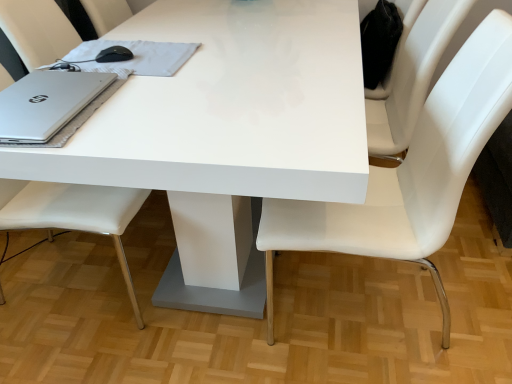
Locate an element on the screen. free space above silver metallic laptop at left (from a real-world perspective) is located at coordinates (34, 97).